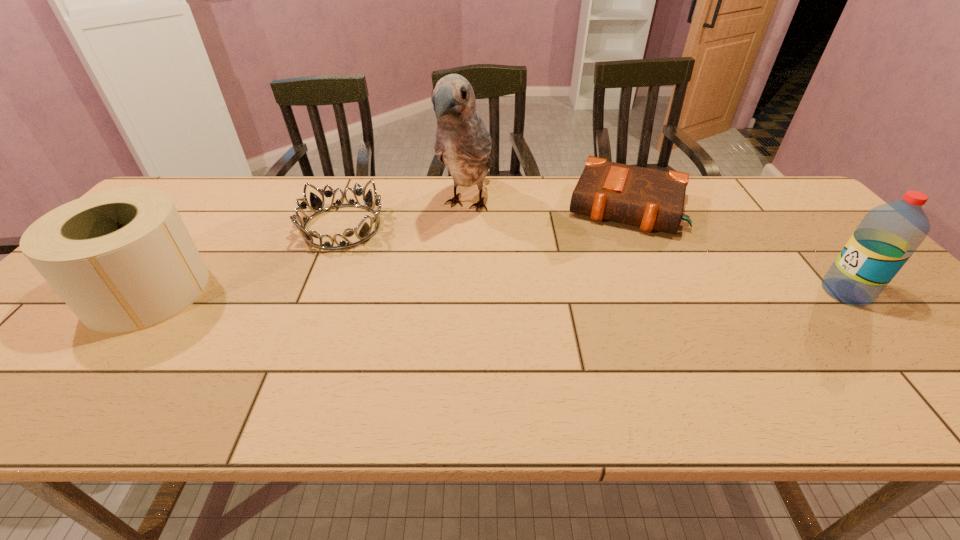
Find the location of a particular element. This screenshot has width=960, height=540. the leftmost object is located at coordinates (122, 260).

I want to click on the third shortest object, so tap(122, 260).

You are a GUI agent. You are given a task and a screenshot of the screen. Output one action in this format:
    pyautogui.click(x=<x>, y=<y>)
    Task: Click on the rightmost object
    
    Given the screenshot: What is the action you would take?
    tap(889, 234)

What are the coordinates of `water bottle` in the screenshot? It's located at (889, 234).

Where is `the third object from right to left`? the third object from right to left is located at coordinates (463, 143).

The image size is (960, 540). Find the location of `the tallest object`. the tallest object is located at coordinates (463, 143).

Find the location of a particular element. The height and width of the screenshot is (540, 960). the second object from left to right is located at coordinates (316, 203).

Locate an element on the screen. the second object from right to left is located at coordinates (651, 199).

Find the location of a particular element. This screenshot has height=540, width=960. free spot located 0.230m on the back of the leftmost object is located at coordinates [x=214, y=209].

You are a GUI agent. You are given a task and a screenshot of the screen. Output one action in this format:
    pyautogui.click(x=<x>, y=<y>)
    Task: Click on the free space located on the front label of the second tallest object
    The image size is (960, 540).
    Given the screenshot: What is the action you would take?
    pyautogui.click(x=779, y=292)